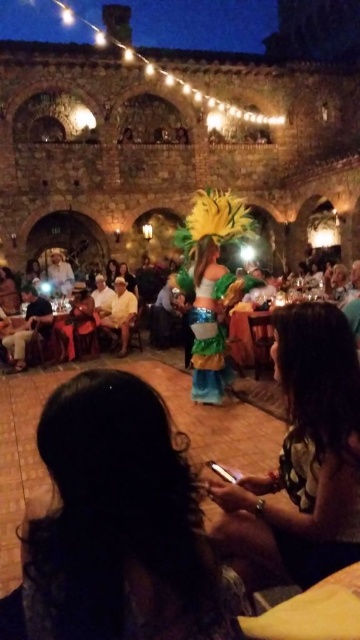
You are standing at the entrance of the rustic venue and see two points marked in the scene. Which point, point 1 at coordinates (254, 314) or point 2 at coordinates (3, 346), is closer to you?

Point 1 at coordinates (254, 314) is closer to you because it is further to the viewer than point 2 at coordinates (3, 346).

You are at the event and want to place both the shiny metallic phone at lower right and the light brown leather jacket at lower left into a small pouch that can only hold items smaller than the jacket. Can you fit both items into the pouch?

The shiny metallic phone at lower right is bigger than the light brown leather jacket at lower left. Since the pouch can only hold items smaller than the jacket, the phone cannot fit, so only the jacket can be placed inside.

In the scene shown: You are at the festive event and want to place your shiny metallic phone at lower right and light brown leather jacket at lower left on a small shelf that can only hold items up to 10 inches in height. Can both items fit on the shelf?

The shiny metallic phone at lower right is much taller than the light brown leather jacket at lower left. Since the shelf can only hold items up to 10 inches, we need to know the exact height of the taller item. However, the description only states their relative sizes. Without specific measurements, we cannot confirm if both will fit.